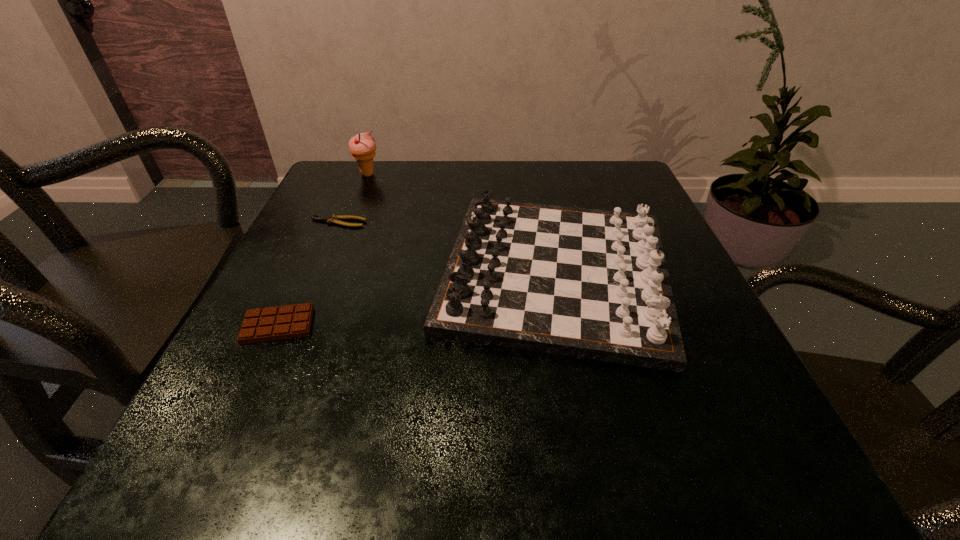
Find the location of a particular element. Image resolution: width=960 pixels, height=540 pixels. vacant space that satisfies the following two spatial constraints: 1. on the back side of the candy bar; 2. on the left side of the pliers is located at coordinates click(326, 222).

The height and width of the screenshot is (540, 960). Find the location of `free spot that satisfies the following two spatial constraints: 1. on the front side of the farthest object; 2. on the left side of the rightmost object`. free spot that satisfies the following two spatial constraints: 1. on the front side of the farthest object; 2. on the left side of the rightmost object is located at coordinates pos(328,272).

The image size is (960, 540). Identify the location of free region that satisfies the following two spatial constraints: 1. on the back side of the farthest object; 2. on the left side of the shortest object. (359, 174).